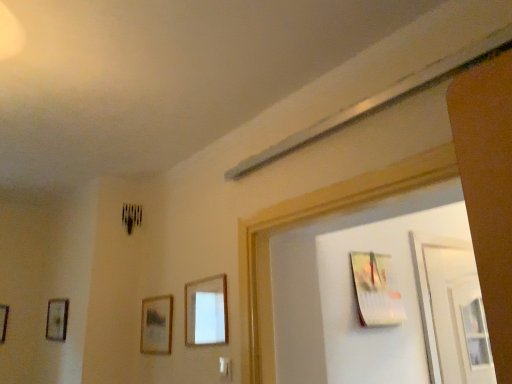
Question: Is point (57, 314) closer or farther from the camera than point (400, 304)?

Choices:
 (A) closer
 (B) farther

Answer: (B)

Question: From their relative heights in the image, would you say wooden picture frame at left, which is counted as the fourth picture frame, starting from the right, is taller or shorter than metallic silver picture frame at upper right, the 5th picture frame when ordered from left to right?

Choices:
 (A) tall
 (B) short

Answer: (B)

Question: Which of these objects is positioned closest to the metallic silver picture frame at upper right, the 5th picture frame when ordered from left to right?

Choices:
 (A) wooden picture frame at left, the 2th picture frame positioned from the left
 (B) wooden picture frame at center, acting as the 2th picture frame starting from the right
 (C) wooden picture frame at left, the fifth picture frame viewed from the right
 (D) wooden picture frame at lower center, arranged as the third picture frame when viewed from the left

Answer: (B)

Question: Considering the real-world distances, which object is farthest from the wooden picture frame at left, the fifth picture frame viewed from the right?

Choices:
 (A) wooden picture frame at left, which is counted as the fourth picture frame, starting from the right
 (B) metallic silver picture frame at upper right, the 1th picture frame when ordered from right to left
 (C) wooden picture frame at center, positioned as the fourth picture frame in left-to-right order
 (D) wooden picture frame at lower center, arranged as the third picture frame when viewed from the left

Answer: (B)